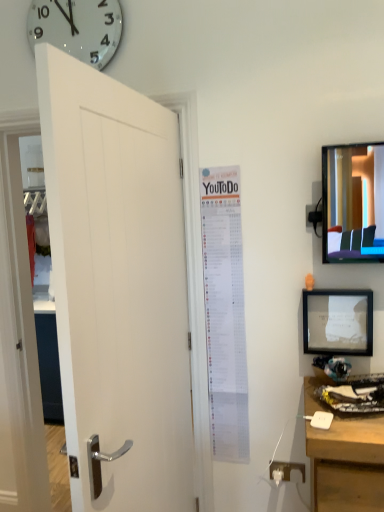
Question: In terms of height, does white paper poster at center look taller or shorter compared to white plastic outlet at lower right?

Choices:
 (A) tall
 (B) short

Answer: (A)

Question: Considering the positions of point (228, 361) and point (284, 475), is point (228, 361) closer or farther from the camera than point (284, 475)?

Choices:
 (A) closer
 (B) farther

Answer: (B)

Question: Which object is the closest to the white glossy clock at upper left?

Choices:
 (A) white wooden door at left
 (B) matte black picture frame at right
 (C) white plastic outlet at lower right
 (D) white paper poster at center

Answer: (A)

Question: Which is farther from the white plastic outlet at lower right?

Choices:
 (A) matte black picture frame at right
 (B) white wooden door at left
 (C) white paper poster at center
 (D) white glossy clock at upper left

Answer: (D)